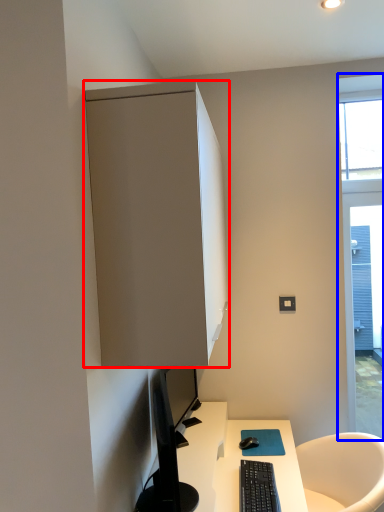
Question: Which object is closer to the camera taking this photo, cabinetry (highlighted by a red box) or window (highlighted by a blue box)?

Choices:
 (A) cabinetry
 (B) window

Answer: (A)